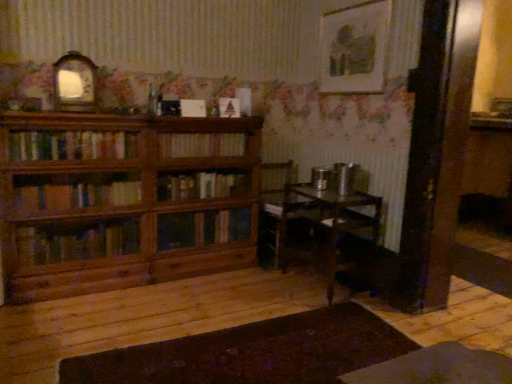
Question: Can we say matte white triangle at center, arranged as the first book when viewed from the top, lies outside wooden bookcase at left?

Choices:
 (A) yes
 (B) no

Answer: (A)

Question: From a real-world perspective, is matte white triangle at center, arranged as the first book when viewed from the top, beneath wooden bookcase at left?

Choices:
 (A) no
 (B) yes

Answer: (A)

Question: Does matte white triangle at center, the 2th book from the bottom, have a larger size compared to wooden bookcase at left?

Choices:
 (A) no
 (B) yes

Answer: (A)

Question: Considering the relative positions of matte white triangle at center, the 2th book from the bottom, and wooden bookcase at left in the image provided, is matte white triangle at center, the 2th book from the bottom, to the right of wooden bookcase at left from the viewer's perspective?

Choices:
 (A) no
 (B) yes

Answer: (B)

Question: From the image's perspective, would you say matte white triangle at center, the 2th book from the bottom, is positioned over wooden bookcase at left?

Choices:
 (A) no
 (B) yes

Answer: (B)

Question: From the image's perspective, is wooden chair at center positioned above or below matte white picture frame at upper right, marked as the 2th picture frame in a left-to-right arrangement?

Choices:
 (A) above
 (B) below

Answer: (B)

Question: Looking at their shapes, would you say wooden chair at center is wider or thinner than matte white picture frame at upper right, which ranks as the first picture frame in right-to-left order?

Choices:
 (A) thin
 (B) wide

Answer: (B)

Question: Do you think wooden chair at center is within matte white picture frame at upper right, marked as the 2th picture frame in a left-to-right arrangement, or outside of it?

Choices:
 (A) outside
 (B) inside

Answer: (A)

Question: Does point (286, 170) appear closer or farther from the camera than point (372, 0)?

Choices:
 (A) farther
 (B) closer

Answer: (A)

Question: Considering their positions, is wooden clock at upper left, the 1th picture frame from the left, located in front of or behind wooden bookcase at left?

Choices:
 (A) behind
 (B) front

Answer: (A)

Question: Would you say wooden clock at upper left, the 1th picture frame from the left, is inside or outside wooden bookcase at left?

Choices:
 (A) outside
 (B) inside

Answer: (A)

Question: From the image's perspective, is wooden clock at upper left, the 1th picture frame from the left, located above or below wooden bookcase at left?

Choices:
 (A) above
 (B) below

Answer: (A)

Question: Is wooden clock at upper left, the 1th picture frame from the left, wider or thinner than wooden bookcase at left?

Choices:
 (A) thin
 (B) wide

Answer: (A)

Question: Based on their positions, is wooden bookcase at left located to the left or right of matte white triangle at center, the 2th book from the bottom?

Choices:
 (A) left
 (B) right

Answer: (A)

Question: From a real-world perspective, is wooden bookcase at left physically located above or below matte white triangle at center, the 2th book from the bottom?

Choices:
 (A) above
 (B) below

Answer: (B)